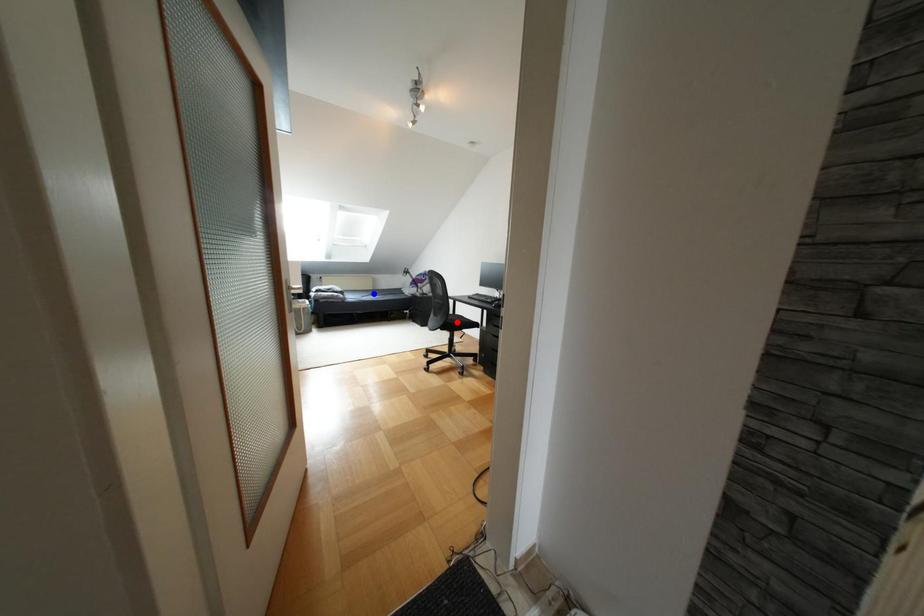
Question: Which of the two points in the image is closer to the camera?

Choices:
 (A) Blue point is closer.
 (B) Red point is closer.

Answer: (B)